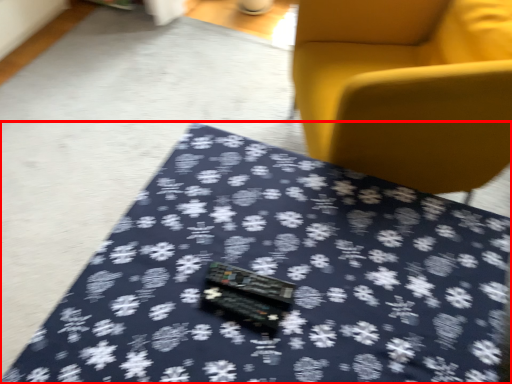
Question: From the image, what is the correct spatial relationship of table (annotated by the red box) in relation to chair?

Choices:
 (A) right
 (B) left

Answer: (B)